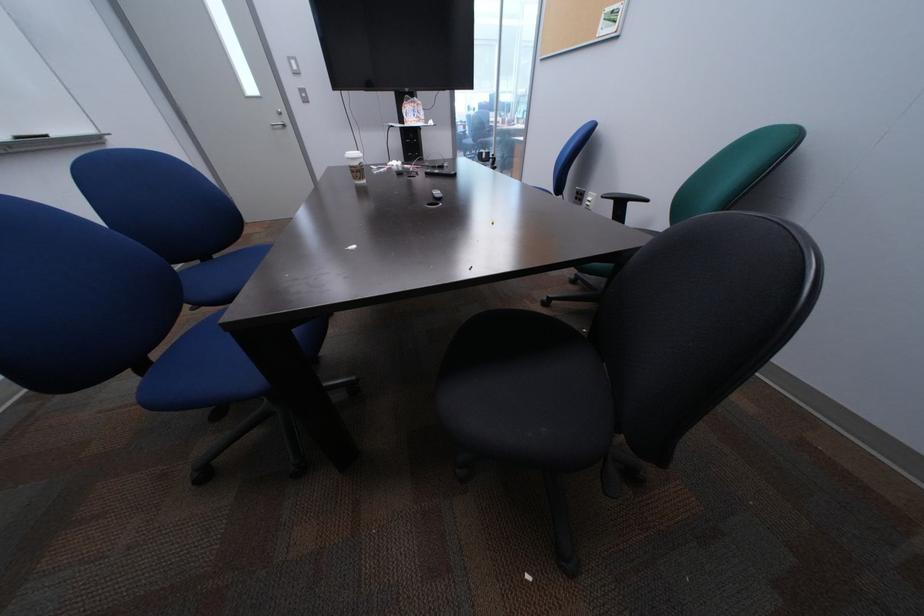
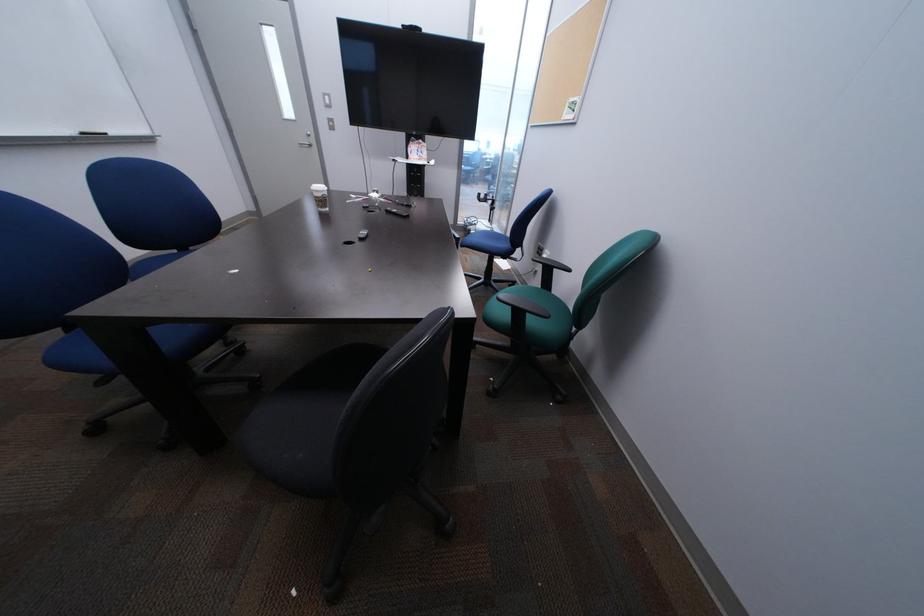
Question: What movement of the cameraman would produce the second image?

Choices:
 (A) Left
 (B) Right
 (C) Forward
 (D) Backward

Answer: (B)